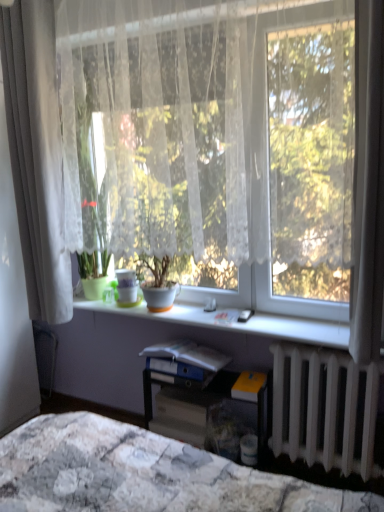
Identify the location of vacant area that lies to the right of black plastic remote control at center. The width and height of the screenshot is (384, 512). (276, 321).